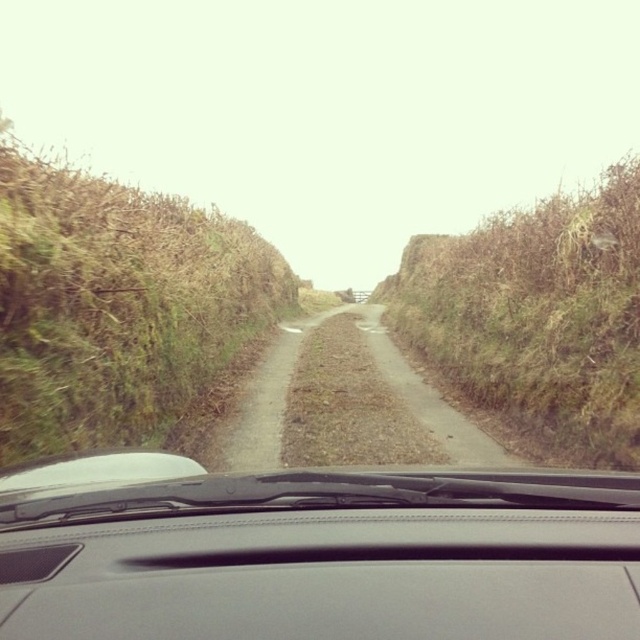
Question: Which point is closer to the camera taking this photo?

Choices:
 (A) (54, 413)
 (B) (474, 504)
 (C) (442, 429)
 (D) (461, 388)

Answer: (B)

Question: Does black matte windshield wiper at center come in front of dirt/gravel road at center?

Choices:
 (A) no
 (B) yes

Answer: (B)

Question: In this image, where is green grassy hedge at left located relative to brown grassy hedge at right?

Choices:
 (A) left
 (B) right

Answer: (A)

Question: Which object is the farthest from the black matte windshield wiper at center?

Choices:
 (A) brown grassy hedge at right
 (B) green grassy hedge at left
 (C) dirt/gravel road at center

Answer: (A)

Question: Which point is closer to the camera?

Choices:
 (A) brown grassy hedge at right
 (B) green grassy hedge at left
 (C) black matte windshield wiper at center

Answer: (C)

Question: Is black matte windshield wiper at center to the right of brown grassy hedge at right from the viewer's perspective?

Choices:
 (A) yes
 (B) no

Answer: (B)